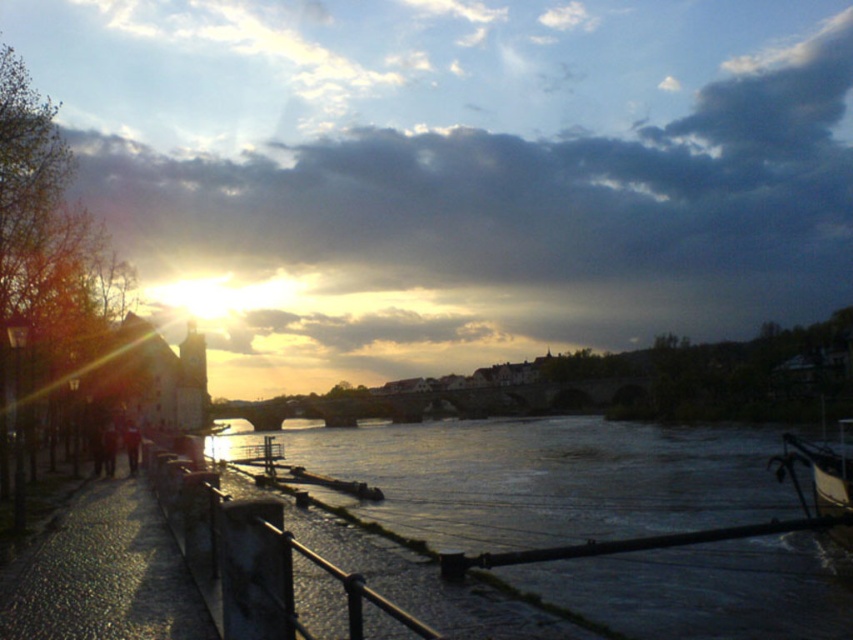
Is silvery reflective water at center thinner than smooth concrete railing at lower left?

No.

I want to click on silvery reflective water at center, so click(x=544, y=477).

This screenshot has width=853, height=640. What do you see at coordinates (248, 556) in the screenshot?
I see `smooth concrete railing at lower left` at bounding box center [248, 556].

Can you confirm if smooth concrete railing at lower left is thinner than metallic polished boat at lower right?

Correct, smooth concrete railing at lower left's width is less than metallic polished boat at lower right's.

Is point (195, 486) positioned behind point (828, 474)?

No, it is not.

Image resolution: width=853 pixels, height=640 pixels. I want to click on smooth concrete railing at lower left, so click(248, 556).

Does point (525, 429) lie behind point (817, 445)?

Yes, point (525, 429) is farther from viewer.

Locate an element on the screen. The image size is (853, 640). silvery reflective water at center is located at coordinates (544, 477).

Image resolution: width=853 pixels, height=640 pixels. Find the location of `silvery reflective water at center`. silvery reflective water at center is located at coordinates (544, 477).